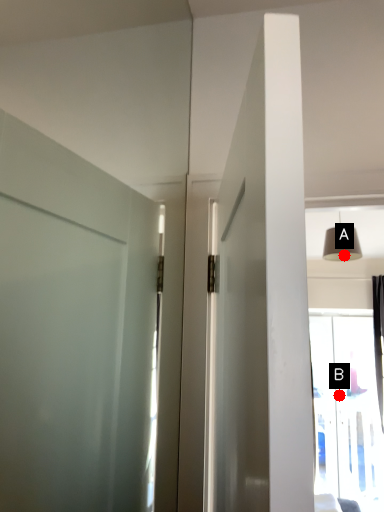
Question: Two points are circled on the image, labeled by A and B beside each circle. Which point is further to the camera?

Choices:
 (A) A is further
 (B) B is further

Answer: (B)